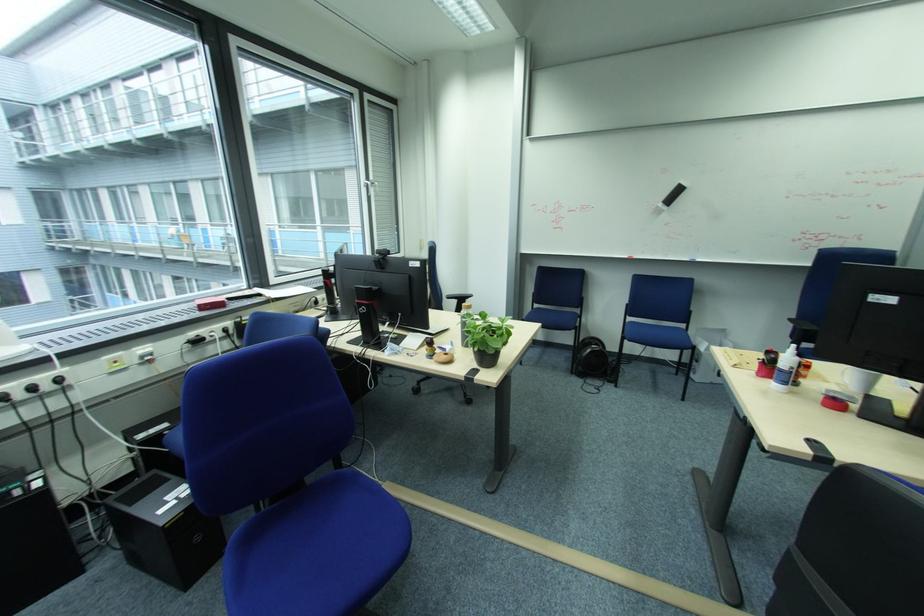
Identify the location of chair armrest. pyautogui.click(x=754, y=460).